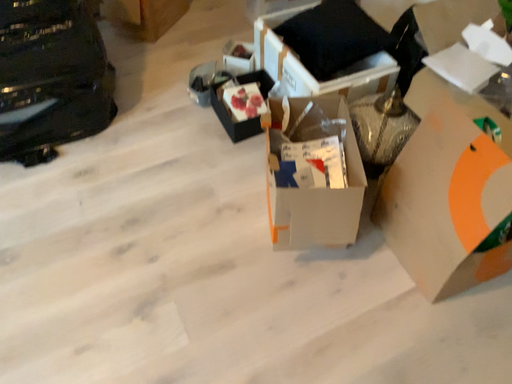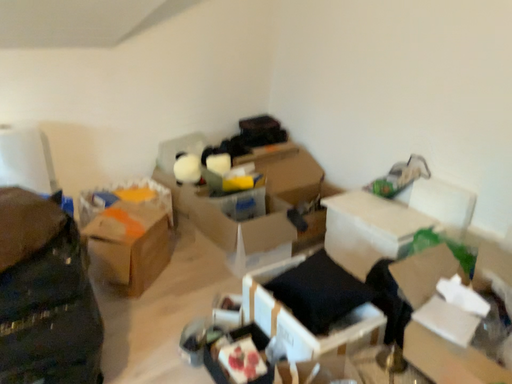
Question: How did the camera likely rotate when shooting the video?

Choices:
 (A) rotated upward
 (B) rotated downward

Answer: (A)